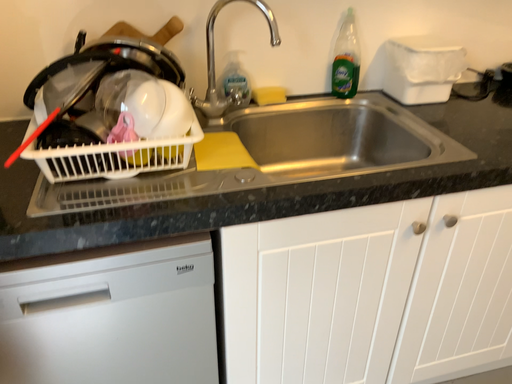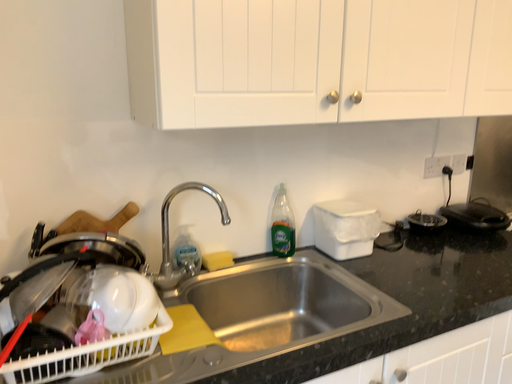
Question: Which way did the camera rotate in the video?

Choices:
 (A) rotated right
 (B) rotated left

Answer: (A)